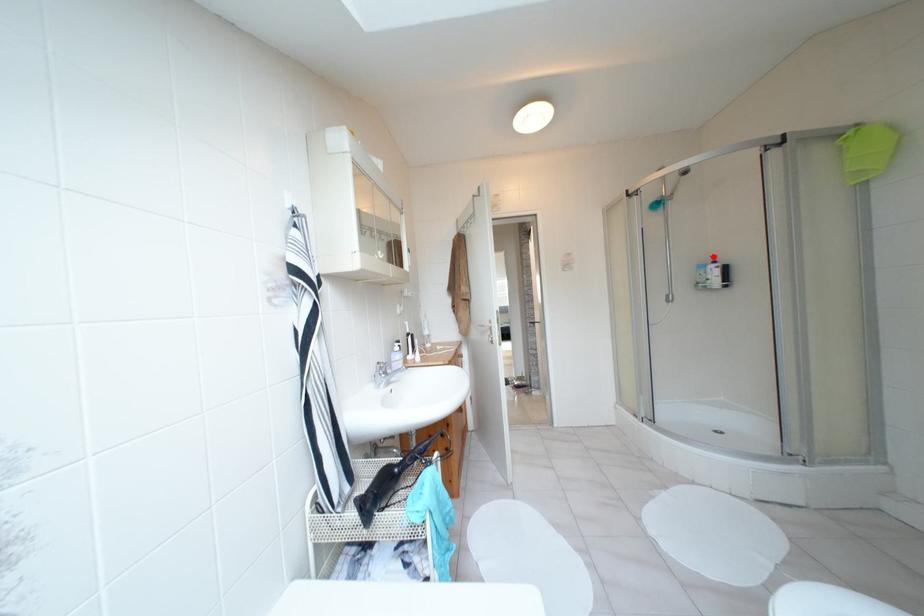
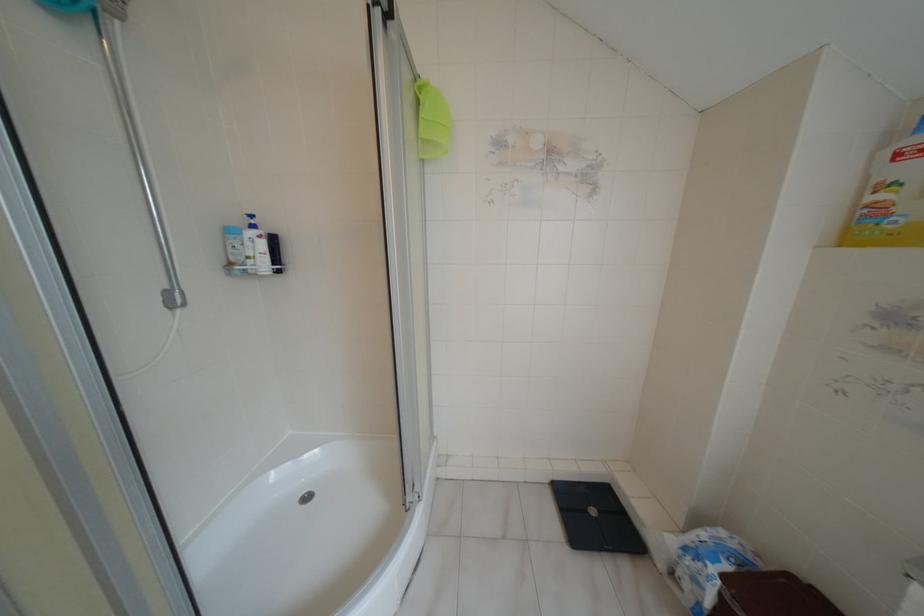
The point at the highlighted location is marked in the first image. Where is the corresponding point in the second image?

(251, 216)